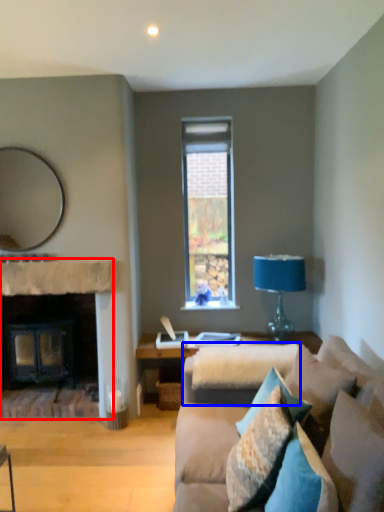
Question: Which of the following is the closest to the observer, fireplace (highlighted by a red box) or beige (highlighted by a blue box)?

Choices:
 (A) fireplace
 (B) beige

Answer: (B)